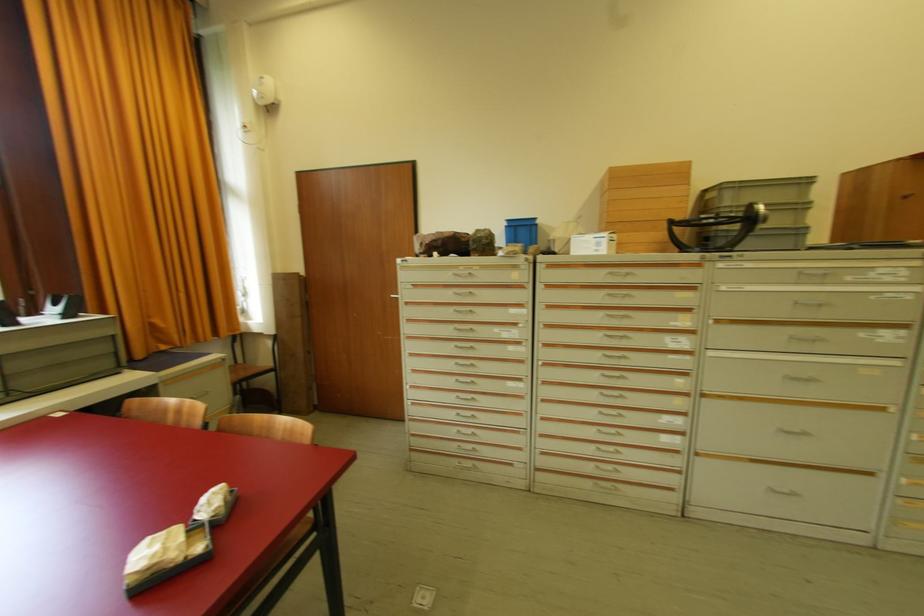
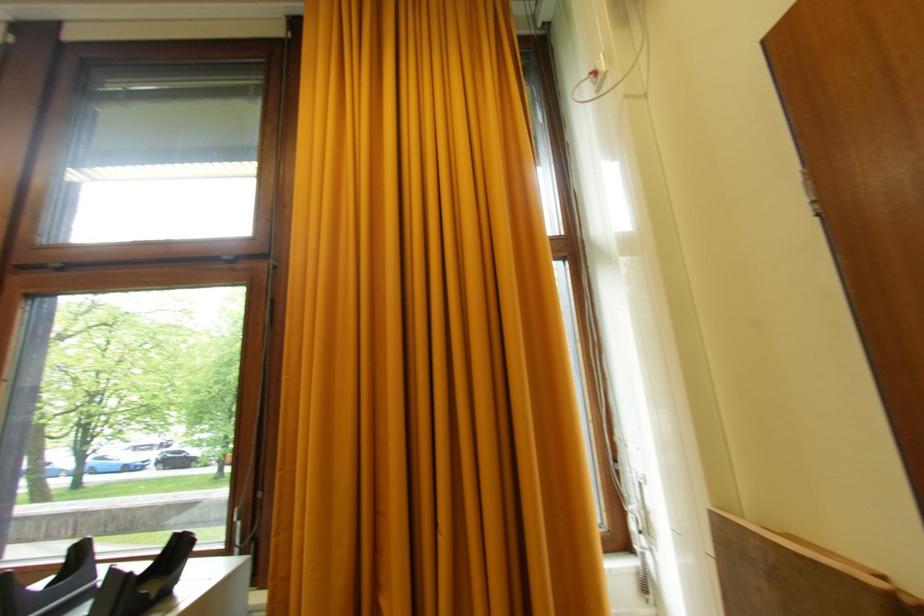
In the second image, find the point that corresponds to pixel 251 129 in the first image.

(604, 69)